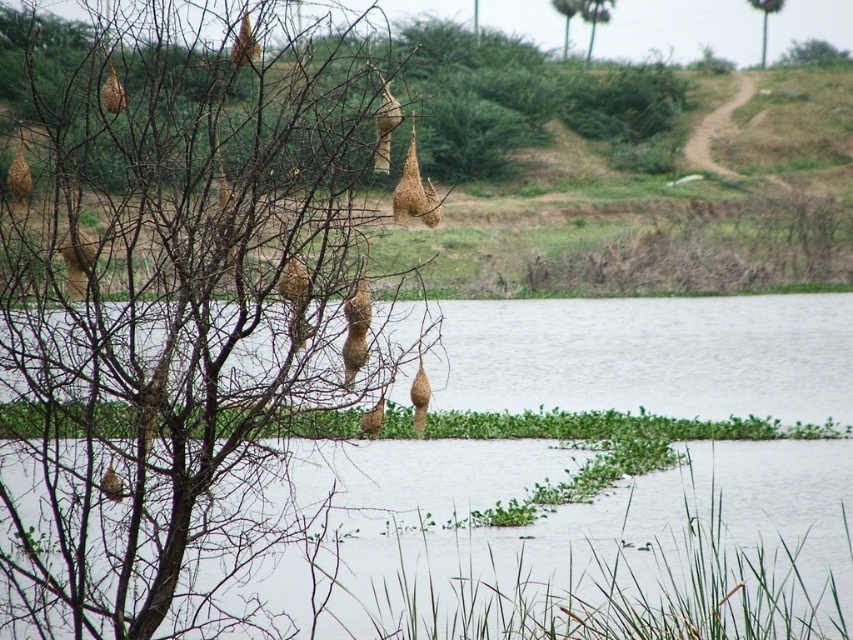
You are an ornithologist observing the nests in the image. You need to determine which object is taller between the brown woven nest at left and the green leafy tree at upper center. Based on the scene, which one is taller?

The brown woven nest at left is taller than the green leafy tree at upper center according to the description.